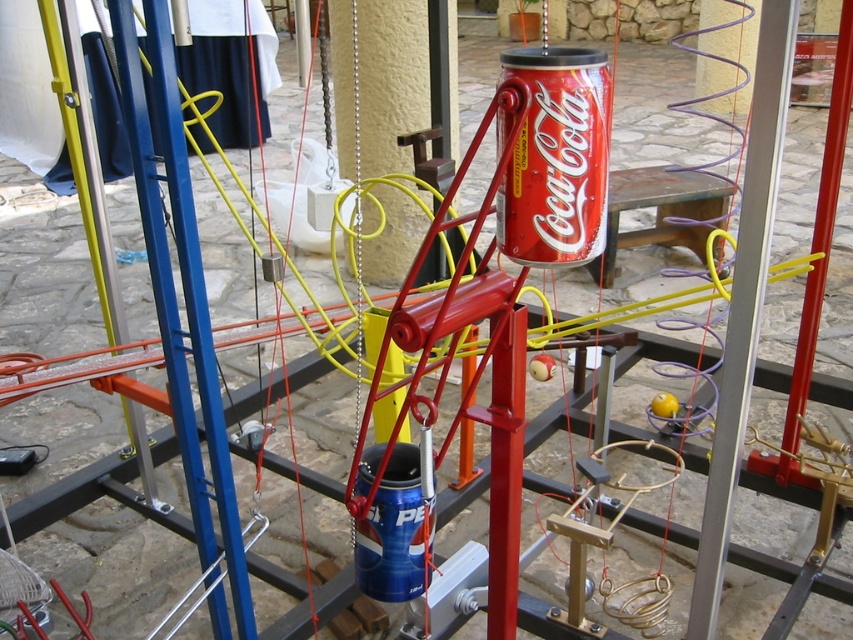
Question: Which object is the farthest from the silver metallic pole at left?

Choices:
 (A) silver metallic pole at center
 (B) blue metallic pepsi can at center
 (C) red matte coca-cola can at center
 (D) metallic red pole at center

Answer: (D)

Question: Can you confirm if silver metallic pole at center is thinner than blue metallic pole at left?

Choices:
 (A) yes
 (B) no

Answer: (A)

Question: Can you confirm if silver metallic pole at left is thinner than blue metallic pepsi can at center?

Choices:
 (A) no
 (B) yes

Answer: (A)

Question: Which of the following is the closest to the observer?

Choices:
 (A) red matte coca-cola can at center
 (B) blue metallic pepsi can at center
 (C) blue metallic pole at left
 (D) metallic red pole at center

Answer: (A)

Question: Estimate the real-world distances between objects in this image. Which object is farther from the metallic red pole at center?

Choices:
 (A) blue metallic pole at left
 (B) red matte coca-cola can at center
 (C) blue metallic pepsi can at center

Answer: (A)

Question: Is blue metallic pole at left positioned behind silver metallic pole at left?

Choices:
 (A) yes
 (B) no

Answer: (B)